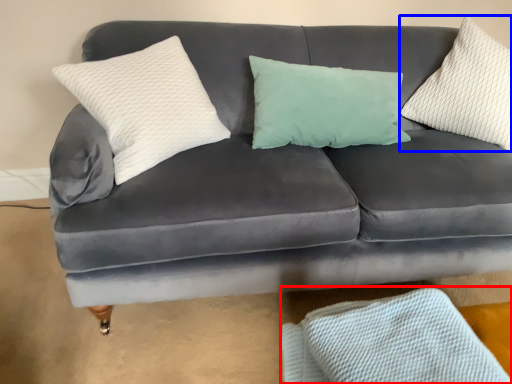
Question: Which object appears closest to the camera in this image, material (highlighted by a red box) or pillow (highlighted by a blue box)?

Choices:
 (A) material
 (B) pillow

Answer: (A)